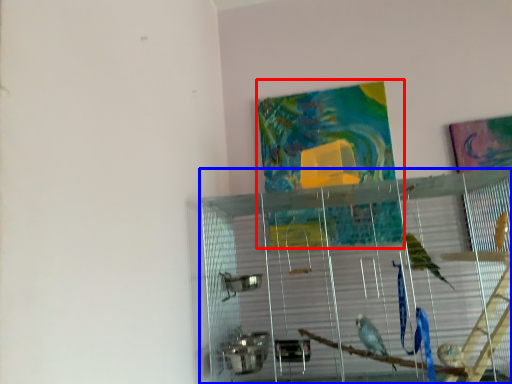
Question: Which object appears closest to the camera in this image, tapestry (highlighted by a red box) or glass box (highlighted by a blue box)?

Choices:
 (A) tapestry
 (B) glass box

Answer: (B)